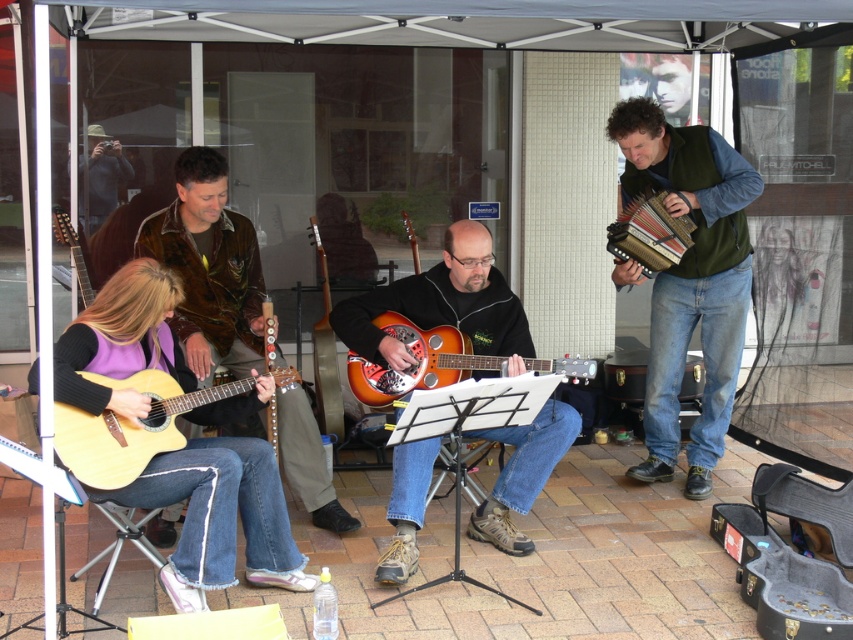
Question: Which point is farther from the camera taking this photo?

Choices:
 (A) (268, 577)
 (B) (80, 294)
 (C) (181, 388)
 (D) (408, 332)

Answer: (B)

Question: In this image, where is leather jacket at center located relative to light wood acoustic guitar at lower left?

Choices:
 (A) right
 (B) left

Answer: (A)

Question: Based on their relative distances, which object is nearer to the green fabric vest at right?

Choices:
 (A) matte yellow guitar at lower left
 (B) sunburst wood resonator guitar at center

Answer: (B)

Question: Which of these objects is positioned farthest from the light wood acoustic guitar at lower left?

Choices:
 (A) orange glossy guitar at center
 (B) green fabric vest at right
 (C) matte wood guitar at left

Answer: (B)

Question: Is orange glossy guitar at center closer to the viewer compared to sunburst wood resonator guitar at center?

Choices:
 (A) no
 (B) yes

Answer: (A)

Question: Is light wood acoustic guitar at lower left above sunburst wood resonator guitar at center?

Choices:
 (A) no
 (B) yes

Answer: (A)